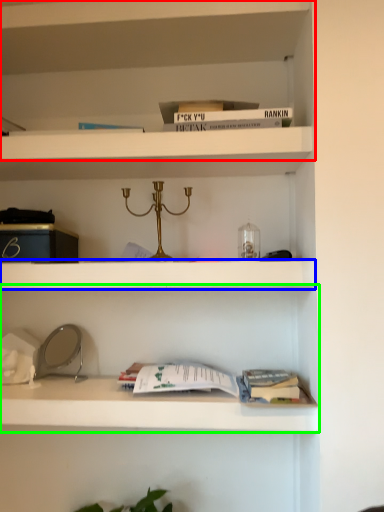
Question: Based on their relative distances, which object is farther from shelf (highlighted by a red box)? Choose from cabinet (highlighted by a blue box) and shelf (highlighted by a green box).

Choices:
 (A) cabinet
 (B) shelf

Answer: (B)